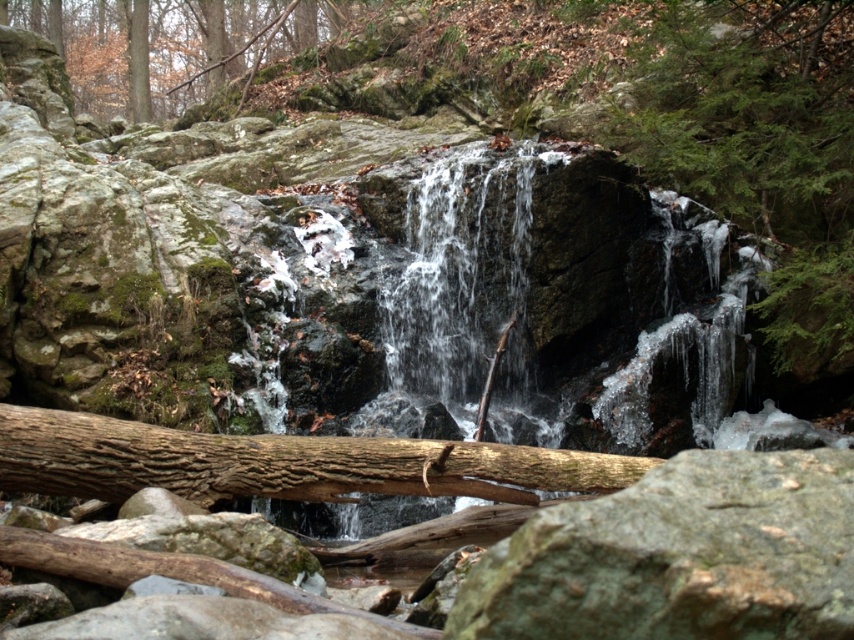
Question: Does gray rough rock at center appear on the right side of green mossy rock at upper left?

Choices:
 (A) no
 (B) yes

Answer: (B)

Question: Does green textured rock at right have a lesser width compared to green mossy rock at upper left?

Choices:
 (A) yes
 (B) no

Answer: (A)

Question: Can you confirm if green textured rock at right is wider than green mossy rock at upper left?

Choices:
 (A) no
 (B) yes

Answer: (A)

Question: Based on their relative distances, which object is farther from the green mossy rock at upper left?

Choices:
 (A) gray rough rock at center
 (B) green textured rock at right

Answer: (A)

Question: Considering the real-world distances, which object is closest to the green mossy rock at upper left?

Choices:
 (A) gray rough rock at center
 (B) green textured rock at right

Answer: (B)

Question: Estimate the real-world distances between objects in this image. Which object is farther from the gray rough rock at center?

Choices:
 (A) green mossy rock at upper left
 (B) green textured rock at right

Answer: (A)